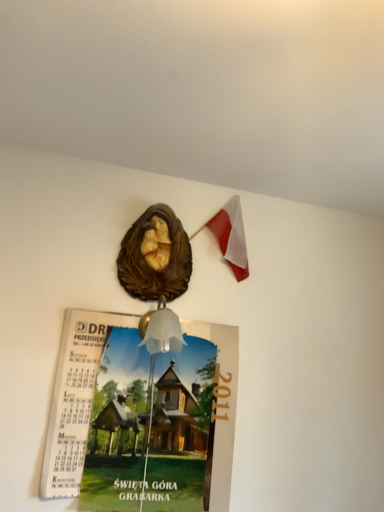
Question: Is white fabric flag at upper right facing towards translucent glass bell at center?

Choices:
 (A) yes
 (B) no

Answer: (B)

Question: Are white fabric flag at upper right and translucent glass bell at center beside each other?

Choices:
 (A) no
 (B) yes

Answer: (A)

Question: Does white fabric flag at upper right appear on the right side of translucent glass bell at center?

Choices:
 (A) no
 (B) yes

Answer: (B)

Question: Is white fabric flag at upper right at the left side of translucent glass bell at center?

Choices:
 (A) no
 (B) yes

Answer: (A)

Question: Can you confirm if white fabric flag at upper right is bigger than translucent glass bell at center?

Choices:
 (A) yes
 (B) no

Answer: (A)

Question: Is white fabric flag at upper right behind translucent glass bell at center?

Choices:
 (A) yes
 (B) no

Answer: (A)

Question: Can you confirm if translucent glass bell at center is positioned to the left of white fabric flag at upper right?

Choices:
 (A) yes
 (B) no

Answer: (A)

Question: Does translucent glass bell at center come behind white fabric flag at upper right?

Choices:
 (A) no
 (B) yes

Answer: (A)

Question: Is the surface of translucent glass bell at center in direct contact with white fabric flag at upper right?

Choices:
 (A) no
 (B) yes

Answer: (A)

Question: Can you confirm if translucent glass bell at center is smaller than white fabric flag at upper right?

Choices:
 (A) yes
 (B) no

Answer: (A)

Question: Is translucent glass bell at center bigger than white fabric flag at upper right?

Choices:
 (A) no
 (B) yes

Answer: (A)

Question: Is translucent glass bell at center facing towards white fabric flag at upper right?

Choices:
 (A) no
 (B) yes

Answer: (A)

Question: Can you confirm if white fabric flag at upper right is positioned to the right of matte paper calendar at upper center?

Choices:
 (A) no
 (B) yes

Answer: (B)